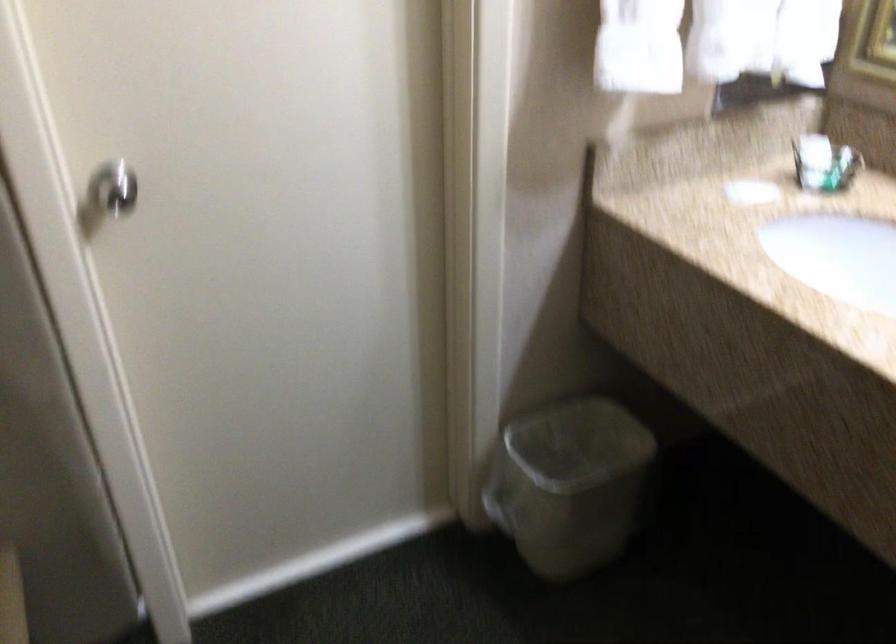
Where is `metal door knob`? The width and height of the screenshot is (896, 644). metal door knob is located at coordinates (114, 187).